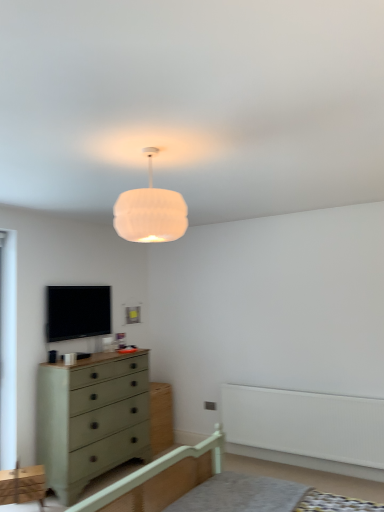
Find the location of a particular element. The height and width of the screenshot is (512, 384). empty space that is ontop of white fabric lampshade at upper center (from a real-world perspective) is located at coordinates (157, 146).